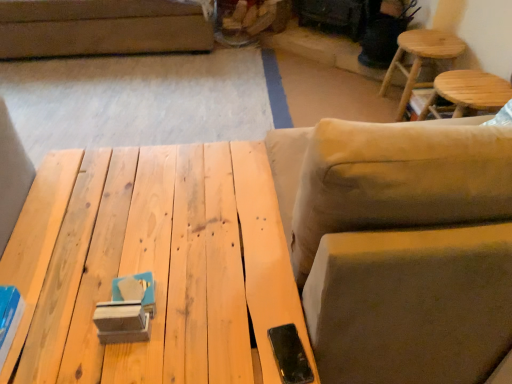
Measure the distance between beige fabric swivel chair at right and camera.

The distance of beige fabric swivel chair at right from camera is 28.80 inches.

This screenshot has height=384, width=512. Describe the element at coordinates (468, 92) in the screenshot. I see `wooden stool at upper right, which is the second stool in back-to-front order` at that location.

Where is `beige fabric swivel chair at right`? The height and width of the screenshot is (384, 512). beige fabric swivel chair at right is located at coordinates (400, 246).

From a real-world perspective, who is located lower, beige fabric swivel chair at right or wooden stool at upper right, which is the second stool in back-to-front order?

From a 3D spatial view, wooden stool at upper right, which is the second stool in back-to-front order, is below.

Looking at this image, could you tell me if beige fabric swivel chair at right is facing wooden stool at upper right, which is counted as the first stool, starting from the front?

Yes, beige fabric swivel chair at right faces towards wooden stool at upper right, which is counted as the first stool, starting from the front.

From the image's perspective, which one is positioned lower, beige fabric swivel chair at right or wooden stool at upper right, which is counted as the first stool, starting from the front?

beige fabric swivel chair at right, from the image's perspective.

Would you say wooden stool at upper right, which is counted as the first stool, starting from the front, is to the left or to the right of natural wood table at center in the picture?

In the image, wooden stool at upper right, which is counted as the first stool, starting from the front, appears on the right side of natural wood table at center.

Which is in front, wooden stool at upper right, which is counted as the first stool, starting from the front, or natural wood table at center?

Positioned in front is natural wood table at center.

From the image's perspective, is wooden stool at upper right, which is the second stool in back-to-front order, located above or below natural wood table at center?

Clearly, from the image's perspective, wooden stool at upper right, which is the second stool in back-to-front order, is above natural wood table at center.

How different are the orientations of wooden stool at upper right, which is the second stool in back-to-front order, and natural wood table at center in degrees?

The angle between the facing direction of wooden stool at upper right, which is the second stool in back-to-front order, and the facing direction of natural wood table at center is 88.9 degrees.

Considering the relative positions of light brown wooden stool at upper right, which ranks as the 1th stool in back-to-front order, and beige fabric swivel chair at right in the image provided, is light brown wooden stool at upper right, which ranks as the 1th stool in back-to-front order, to the right of beige fabric swivel chair at right from the viewer's perspective?

Correct, you'll find light brown wooden stool at upper right, which ranks as the 1th stool in back-to-front order, to the right of beige fabric swivel chair at right.

From the picture: From the image's perspective, is light brown wooden stool at upper right, acting as the 2th stool starting from the front, positioned above or below beige fabric swivel chair at right?

light brown wooden stool at upper right, acting as the 2th stool starting from the front, is situated higher than beige fabric swivel chair at right in the image.

From a real-world perspective, which is physically below, light brown wooden stool at upper right, which ranks as the 1th stool in back-to-front order, or beige fabric swivel chair at right?

light brown wooden stool at upper right, which ranks as the 1th stool in back-to-front order, from a real-world perspective.

Does point (458, 91) come in front of point (441, 61)?

That is True.

Can light brown wooden stool at upper right, which ranks as the 1th stool in back-to-front order, be found inside wooden stool at upper right, which is the second stool in back-to-front order?

No, light brown wooden stool at upper right, which ranks as the 1th stool in back-to-front order, is located outside of wooden stool at upper right, which is the second stool in back-to-front order.

Is wooden stool at upper right, which is counted as the first stool, starting from the front, aimed at light brown wooden stool at upper right, acting as the 2th stool starting from the front?

No, wooden stool at upper right, which is counted as the first stool, starting from the front, is not turned towards light brown wooden stool at upper right, acting as the 2th stool starting from the front.

From the image's perspective, is wooden stool at upper right, which is the second stool in back-to-front order, beneath light brown wooden stool at upper right, which ranks as the 1th stool in back-to-front order?

Indeed, from the image's perspective, wooden stool at upper right, which is the second stool in back-to-front order, is shown beneath light brown wooden stool at upper right, which ranks as the 1th stool in back-to-front order.

Looking at this image, is beige fabric swivel chair at right far from natural wood table at center?

That's not correct — beige fabric swivel chair at right is a little close to natural wood table at center.

From a real-world perspective, is beige fabric swivel chair at right on natural wood table at center?

Yes, from a real-world perspective, beige fabric swivel chair at right is over natural wood table at center

Considering the points (398, 250) and (186, 364), which point is behind, point (398, 250) or point (186, 364)?

The point (186, 364) is farther from the camera.

Which of these two, beige fabric swivel chair at right or natural wood table at center, stands shorter?

With less height is natural wood table at center.

Can you confirm if light brown wooden stool at upper right, which ranks as the 1th stool in back-to-front order, is positioned to the left of natural wood table at center?

Incorrect, light brown wooden stool at upper right, which ranks as the 1th stool in back-to-front order, is not on the left side of natural wood table at center.

Is light brown wooden stool at upper right, acting as the 2th stool starting from the front, taller or shorter than natural wood table at center?

Clearly, light brown wooden stool at upper right, acting as the 2th stool starting from the front, is shorter compared to natural wood table at center.

Find the location of a particular element. The width and height of the screenshot is (512, 384). the 2nd stool behind the natural wood table at center is located at coordinates (421, 59).

Is light brown wooden stool at upper right, which ranks as the 1th stool in back-to-front order, next to natural wood table at center?

They are not placed beside each other.

Based on the photo, considering the positions of objects wooden stool at upper right, which is counted as the first stool, starting from the front, and beige fabric swivel chair at right in the image provided, who is more to the right, wooden stool at upper right, which is counted as the first stool, starting from the front, or beige fabric swivel chair at right?

wooden stool at upper right, which is counted as the first stool, starting from the front.

From the image's perspective, which is below, wooden stool at upper right, which is the second stool in back-to-front order, or beige fabric swivel chair at right?

beige fabric swivel chair at right.

Who is taller, wooden stool at upper right, which is counted as the first stool, starting from the front, or beige fabric swivel chair at right?

beige fabric swivel chair at right is taller.

Is wooden stool at upper right, which is counted as the first stool, starting from the front, closer to camera compared to beige fabric swivel chair at right?

No, it is not.

Identify the location of swivel chair on the left of wooden stool at upper right, which is the second stool in back-to-front order. The image size is (512, 384). (400, 246).

Where is `the 1st stool above the natural wood table at center (from the image's perspective)`? The width and height of the screenshot is (512, 384). the 1st stool above the natural wood table at center (from the image's perspective) is located at coordinates (468, 92).

Considering their positions, is wooden stool at upper right, which is counted as the first stool, starting from the front, positioned further to beige fabric swivel chair at right than light brown wooden stool at upper right, acting as the 2th stool starting from the front?

The object further to beige fabric swivel chair at right is light brown wooden stool at upper right, acting as the 2th stool starting from the front.

Which object lies nearer to the anchor point wooden stool at upper right, which is counted as the first stool, starting from the front, light brown wooden stool at upper right, which ranks as the 1th stool in back-to-front order, or natural wood table at center?

Among the two, light brown wooden stool at upper right, which ranks as the 1th stool in back-to-front order, is located nearer to wooden stool at upper right, which is counted as the first stool, starting from the front.

When comparing their distances from light brown wooden stool at upper right, which ranks as the 1th stool in back-to-front order, does beige fabric swivel chair at right or natural wood table at center seem closer?

Based on the image, beige fabric swivel chair at right appears to be nearer to light brown wooden stool at upper right, which ranks as the 1th stool in back-to-front order.

When comparing their distances from beige fabric swivel chair at right, does wooden stool at upper right, which is the second stool in back-to-front order, or natural wood table at center seem further?

Among the two, wooden stool at upper right, which is the second stool in back-to-front order, is located further to beige fabric swivel chair at right.

Looking at the image, which one is located further to light brown wooden stool at upper right, acting as the 2th stool starting from the front, natural wood table at center or beige fabric swivel chair at right?

natural wood table at center lies further to light brown wooden stool at upper right, acting as the 2th stool starting from the front, than the other object.

Which object lies nearer to the anchor point light brown wooden stool at upper right, which ranks as the 1th stool in back-to-front order, wooden stool at upper right, which is the second stool in back-to-front order, or natural wood table at center?

The object closer to light brown wooden stool at upper right, which ranks as the 1th stool in back-to-front order, is wooden stool at upper right, which is the second stool in back-to-front order.

Which object lies nearer to the anchor point natural wood table at center, light brown wooden stool at upper right, which ranks as the 1th stool in back-to-front order, or beige fabric swivel chair at right?

beige fabric swivel chair at right is closer to natural wood table at center.

Based on their spatial positions, is wooden stool at upper right, which is counted as the first stool, starting from the front, or beige fabric swivel chair at right closer to natural wood table at center?

Based on the image, beige fabric swivel chair at right appears to be nearer to natural wood table at center.

You are a GUI agent. You are given a task and a screenshot of the screen. Output one action in this format:
    pyautogui.click(x=<x>, y=<y>)
    Task: Click on the stool between beige fabric swivel chair at right and light brown wooden stool at upper right, which ranks as the 1th stool in back-to-front order, from front to back
    
    Given the screenshot: What is the action you would take?
    pyautogui.click(x=468, y=92)

This screenshot has height=384, width=512. Find the location of `table between beige fabric swivel chair at right and light brown wooden stool at upper right, acting as the 2th stool starting from the front, from front to back`. table between beige fabric swivel chair at right and light brown wooden stool at upper right, acting as the 2th stool starting from the front, from front to back is located at coordinates (155, 266).

Image resolution: width=512 pixels, height=384 pixels. Identify the location of stool between natural wood table at center and wooden stool at upper right, which is the second stool in back-to-front order. (421, 59).

Image resolution: width=512 pixels, height=384 pixels. Find the location of `swivel chair between natural wood table at center and wooden stool at upper right, which is counted as the first stool, starting from the front, from left to right`. swivel chair between natural wood table at center and wooden stool at upper right, which is counted as the first stool, starting from the front, from left to right is located at coordinates (400, 246).